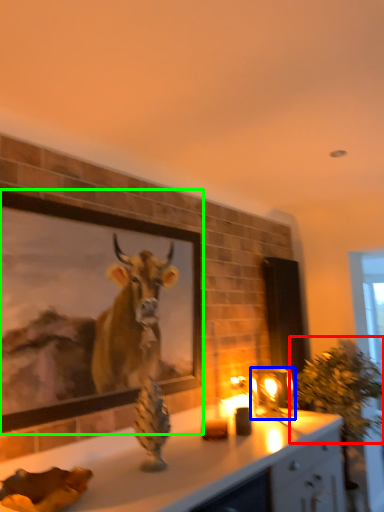
Question: Which object is positioned farthest from plant (highlighted by a red box)? Select from candle holder (highlighted by a blue box) and picture frame (highlighted by a green box).

Choices:
 (A) candle holder
 (B) picture frame

Answer: (B)